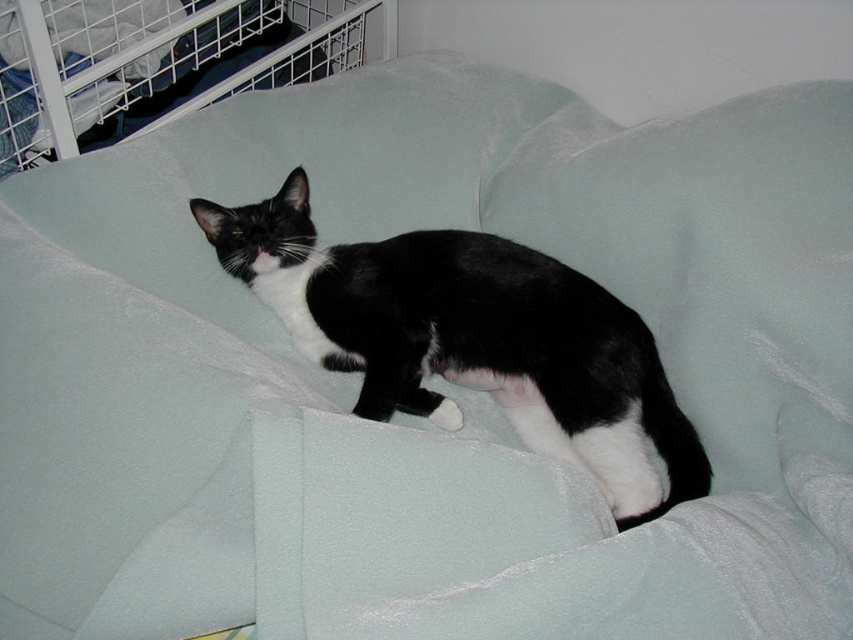
You are trying to determine if the black fur cat at center can fit inside the brushed metal cage at upper left based on their sizes. Can it fit?

The black fur cat at center occupies less space than the brushed metal cage at upper left, so it can fit inside the cage.

You are a pet owner who wants to place the black fur cat at center into the brushed metal cage at upper left. Based on their sizes, will the cat fit comfortably inside the cage?

The black fur cat at center is much taller than the brushed metal cage at upper left, so it will not fit comfortably inside the cage.

You are a pet owner who wants to ensure your black fur cat at center has enough space to move freely. The brushed metal cage at upper left is 12 inches wide. Can the cat move around comfortably without touching the cage?

The black fur cat at center is 16.93 inches away from the brushed metal cage at upper left. Since the cage is only 12 inches wide, the distance between them is sufficient for the cat to move comfortably without touching the cage.